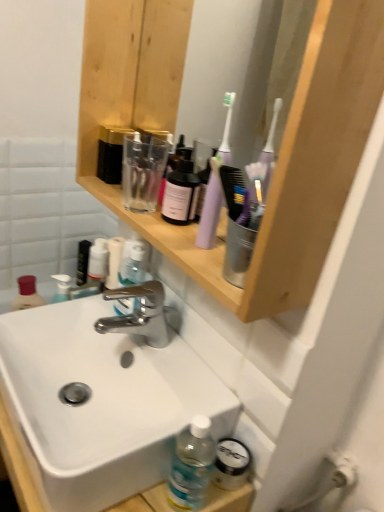
Find the location of a particular element. Image resolution: width=384 pixels, height=512 pixels. clear plastic bottle at center is located at coordinates (132, 264).

You are a GUI agent. You are given a task and a screenshot of the screen. Output one action in this format:
    pyautogui.click(x=<x>, y=<y>)
    Task: Click on the polished chrome faucet at center
    Image resolution: width=384 pixels, height=512 pixels.
    Given the screenshot: What is the action you would take?
    pyautogui.click(x=140, y=313)

What do you see at coordinates (100, 403) in the screenshot?
I see `white glossy sink at center` at bounding box center [100, 403].

At what (x,y) coordinates should I click in order to perform the action: click on black matte tube at upper left. Please return your answer as a coordinate pair (x, y). Looking at the image, I should click on (82, 262).

The image size is (384, 512). What do you see at coordinates (82, 262) in the screenshot?
I see `black matte tube at upper left` at bounding box center [82, 262].

The height and width of the screenshot is (512, 384). Find the location of `transparent plastic bottle at upper center`. transparent plastic bottle at upper center is located at coordinates (181, 191).

Is point (82, 241) behind point (196, 242)?

Yes, it is behind point (196, 242).

Choose the correct answer: Is black matte tube at upper left inside purple plastic toothbrush at upper center or outside it?

black matte tube at upper left is not inside purple plastic toothbrush at upper center, it's outside.

From the image's perspective, between black matte tube at upper left and purple plastic toothbrush at upper center, which one is located above?

purple plastic toothbrush at upper center, from the image's perspective.

Which of these two, black matte tube at upper left or purple plastic toothbrush at upper center, is wider?

black matte tube at upper left.

Which point is more forward, (x=27, y=323) or (x=95, y=89)?

Point (x=95, y=89)

Which object is positioned more to the left, white glossy sink at center or wooden shelf at upper center?

white glossy sink at center.

Which object is further away from the camera, white glossy sink at center or wooden shelf at upper center?

white glossy sink at center is further from the camera.

Can you see white glossy sink at center touching wooden shelf at upper center?

They are not placed beside each other.

Between transparent plastic bottle at upper center and white glossy sink at center, which one has smaller width?

Thinner between the two is transparent plastic bottle at upper center.

Can you tell me how much transparent plastic bottle at upper center and white glossy sink at center differ in facing direction?

The angular difference between transparent plastic bottle at upper center and white glossy sink at center is 0.00281 degrees.

From a real-world perspective, is transparent plastic bottle at upper center physically above white glossy sink at center?

Yes, from a real-world perspective, transparent plastic bottle at upper center is over white glossy sink at center

Which is more to the right, transparent plastic bottle at upper center or white glossy sink at center?

From the viewer's perspective, transparent plastic bottle at upper center appears more on the right side.

Is black matte tube at upper left turned away from polished chrome faucet at center?

No, polished chrome faucet at center is not at the back of black matte tube at upper left.

How many degrees apart are the facing directions of black matte tube at upper left and polished chrome faucet at center?

The facing directions of black matte tube at upper left and polished chrome faucet at center are 2.38 degrees apart.

From a real-world perspective, is black matte tube at upper left on top of polished chrome faucet at center?

No, from a real-world perspective, black matte tube at upper left is not on top of polished chrome faucet at center.

Who is more distant, black matte tube at upper left or polished chrome faucet at center?

black matte tube at upper left is behind.

Does white glossy sink at center turn towards clear plastic bottle at center?

No, white glossy sink at center is not facing towards clear plastic bottle at center.

Is white glossy sink at center in front of or behind clear plastic bottle at center in the image?

white glossy sink at center is positioned closer to the viewer than clear plastic bottle at center.

How different are the orientations of white glossy sink at center and clear plastic bottle at center in degrees?

0.000886 degrees separate the facing orientations of white glossy sink at center and clear plastic bottle at center.

Is white glossy sink at center bigger or smaller than clear plastic bottle at center?

white glossy sink at center is bigger than clear plastic bottle at center.

Is point (120, 288) more distant than point (177, 179)?

Yes, it is behind point (177, 179).

Looking at this image, is polished chrome faucet at center bigger or smaller than transparent plastic bottle at upper center?

Clearly, polished chrome faucet at center is larger in size than transparent plastic bottle at upper center.

Is polished chrome faucet at center turned away from transparent plastic bottle at upper center?

No, transparent plastic bottle at upper center is not at the back of polished chrome faucet at center.

From their relative heights in the image, would you say polished chrome faucet at center is taller or shorter than transparent plastic bottle at upper center?

Clearly, polished chrome faucet at center is shorter compared to transparent plastic bottle at upper center.

From the picture: From a real-world perspective, which is physically above, polished chrome faucet at center or clear plastic bottle at center?

clear plastic bottle at center.

Can you tell me how much polished chrome faucet at center and clear plastic bottle at center differ in facing direction?

0.000744 degrees separate the facing orientations of polished chrome faucet at center and clear plastic bottle at center.

Is clear plastic bottle at center completely or partially inside polished chrome faucet at center?

No, clear plastic bottle at center is not a part of polished chrome faucet at center.

At what (x,y) coordinates should I click in order to perform the action: click on toothbrush located above the black matte tube at upper left (from a real-world perspective). Please return your answer as a coordinate pair (x, y). Image resolution: width=384 pixels, height=512 pixels. Looking at the image, I should click on (215, 184).

The width and height of the screenshot is (384, 512). I want to click on shelf in front of the white glossy sink at center, so click(x=280, y=149).

When comparing their distances from transparent plastic bottle at upper center, does black matte tube at upper left or white glossy sink at center seem further?

Based on the image, black matte tube at upper left appears to be further to transparent plastic bottle at upper center.

Based on their spatial positions, is black matte tube at upper left or purple plastic toothbrush at upper center further from polished chrome faucet at center?

black matte tube at upper left.

Estimate the real-world distances between objects in this image. Which object is further from purple plastic toothbrush at upper center, polished chrome faucet at center or wooden shelf at upper center?

polished chrome faucet at center is positioned further to the anchor purple plastic toothbrush at upper center.

Based on their spatial positions, is wooden shelf at upper center or polished chrome faucet at center further from black matte tube at upper left?

wooden shelf at upper center is further to black matte tube at upper left.

Which object lies further to the anchor point clear plastic bottle at center, transparent plastic bottle at upper center or polished chrome faucet at center?

transparent plastic bottle at upper center is positioned further to the anchor clear plastic bottle at center.

Estimate the real-world distances between objects in this image. Which object is further from wooden shelf at upper center, white glossy sink at center or purple plastic toothbrush at upper center?

white glossy sink at center is further to wooden shelf at upper center.

Based on the photo, when comparing their distances from purple plastic toothbrush at upper center, does white glossy sink at center or wooden shelf at upper center seem further?

white glossy sink at center is positioned further to the anchor purple plastic toothbrush at upper center.

Based on their spatial positions, is purple plastic toothbrush at upper center or transparent plastic bottle at upper center closer to wooden shelf at upper center?

The object closer to wooden shelf at upper center is purple plastic toothbrush at upper center.

This screenshot has height=512, width=384. Identify the location of tap that lies between wooden shelf at upper center and white glossy sink at center from top to bottom. (140, 313).

Where is `tap between white glossy sink at center and black matte tube at upper left in the front-back direction`? tap between white glossy sink at center and black matte tube at upper left in the front-back direction is located at coordinates click(x=140, y=313).

Identify the location of toothbrush that lies between transparent plastic bottle at upper center and white glossy sink at center from top to bottom. (215, 184).

At what (x,y) coordinates should I click in order to perform the action: click on sink between wooden shelf at upper center and black matte tube at upper left along the z-axis. Please return your answer as a coordinate pair (x, y). Image resolution: width=384 pixels, height=512 pixels. Looking at the image, I should click on (100, 403).